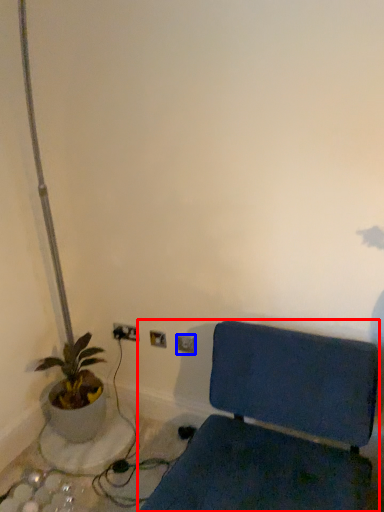
Question: Which point is further to the camera, furniture (highlighted by a red box) or electric outlet (highlighted by a blue box)?

Choices:
 (A) furniture
 (B) electric outlet

Answer: (B)